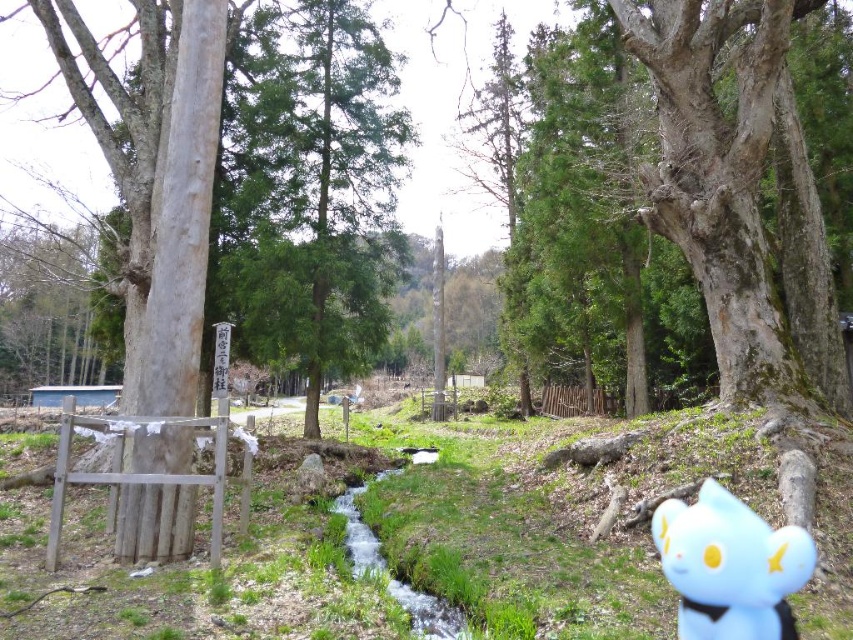
Is blue plush toy at lower right shorter than clear water stream at center?

No.

Which is below, blue plush toy at lower right or clear water stream at center?

clear water stream at center is below.

What do you see at coordinates (730, 566) in the screenshot? The width and height of the screenshot is (853, 640). I see `blue plush toy at lower right` at bounding box center [730, 566].

This screenshot has width=853, height=640. Identify the location of blue plush toy at lower right. (730, 566).